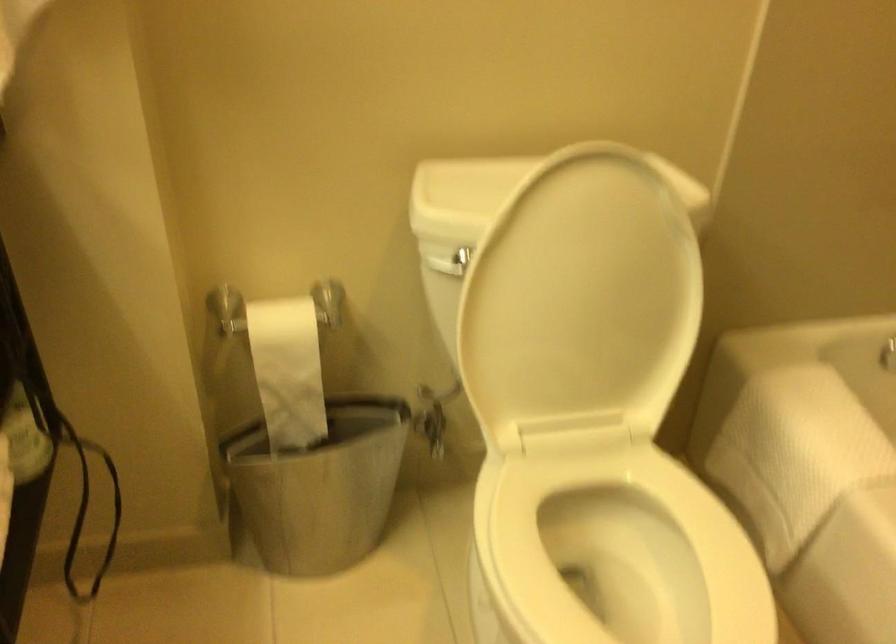
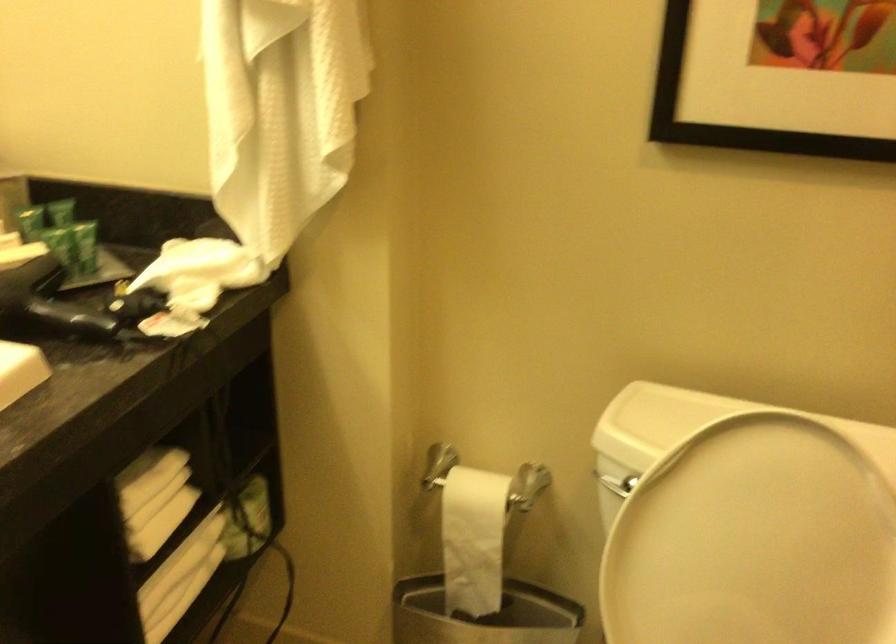
Question: The first image is from the beginning of the video and the second image is from the end. How did the camera likely rotate when shooting the video?

Choices:
 (A) Left
 (B) Right
 (C) Up
 (D) Down

Answer: (A)